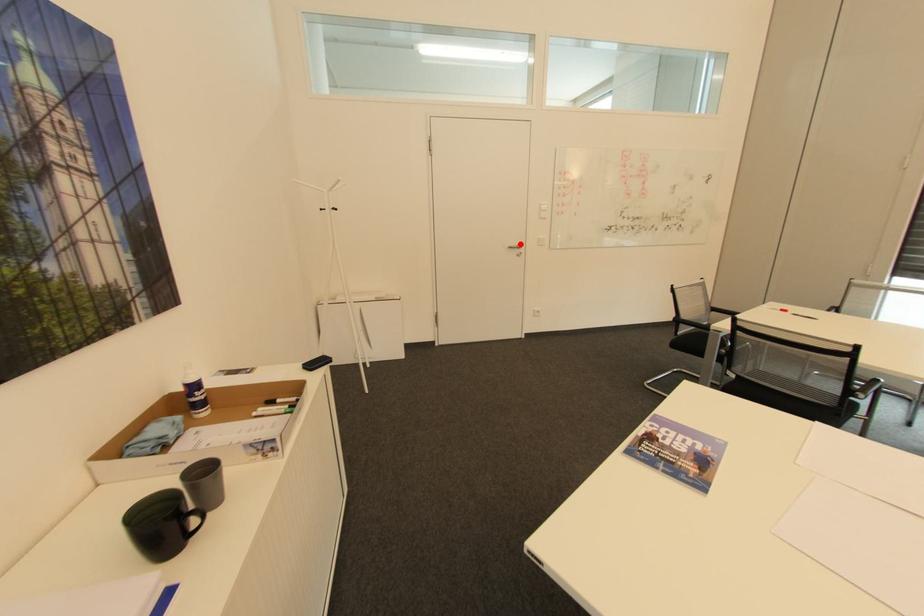
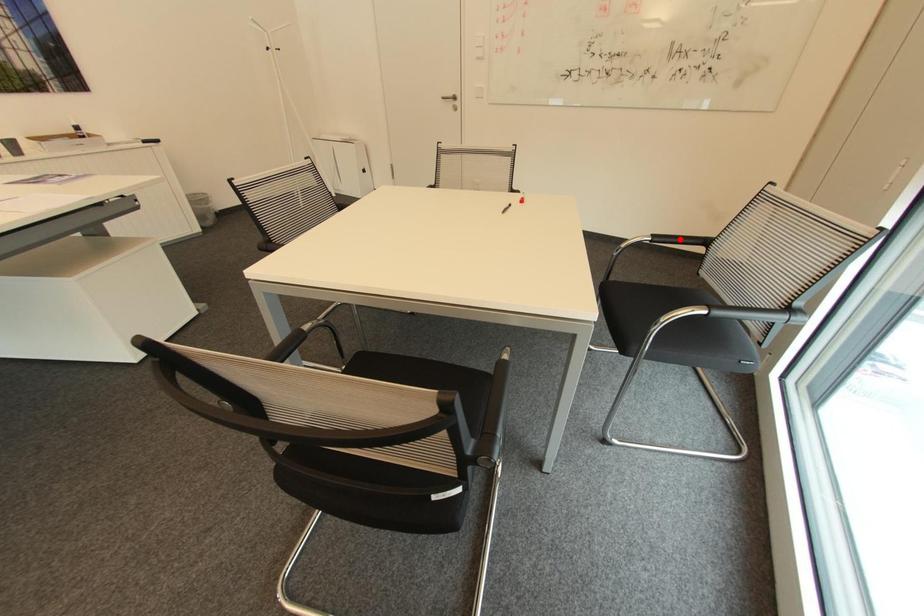
I am providing you with two images of the same scene from different viewpoints. A red point is marked on the first image and another point is marked on the second image. Do the highlighted points in image1 and image2 indicate the same real-world spot?

No